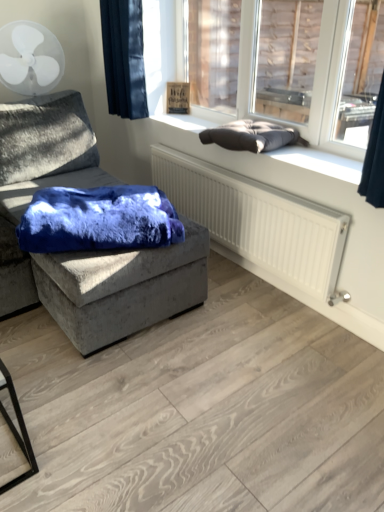
Question: From a real-world perspective, relative to dark blue fabric at upper left, is dark gray cushion at upper right vertically above or below?

Choices:
 (A) above
 (B) below

Answer: (A)

Question: In terms of width, does dark gray cushion at upper right look wider or thinner when compared to dark blue fabric at upper left?

Choices:
 (A) thin
 (B) wide

Answer: (A)

Question: Which object is the closest to the white plastic mechanical fan at upper left?

Choices:
 (A) dark gray cushion at upper right
 (B) dark gray cushion at upper right
 (C) dark blue fabric at upper left
 (D) blue fuzzy blanket at center
 (E) dark gray fabric cushion at upper right

Answer: (C)

Question: Which object is positioned closest to the dark gray cushion at upper right?

Choices:
 (A) dark gray fabric cushion at upper right
 (B) dark blue fabric at upper left
 (C) white plastic mechanical fan at upper left
 (D) blue fuzzy blanket at center
 (E) dark gray cushion at upper right

Answer: (B)